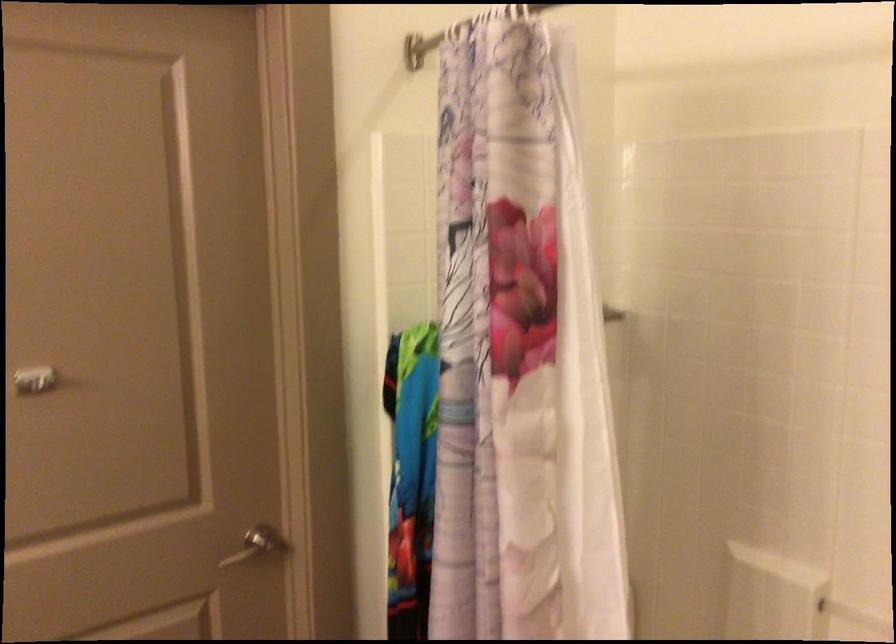
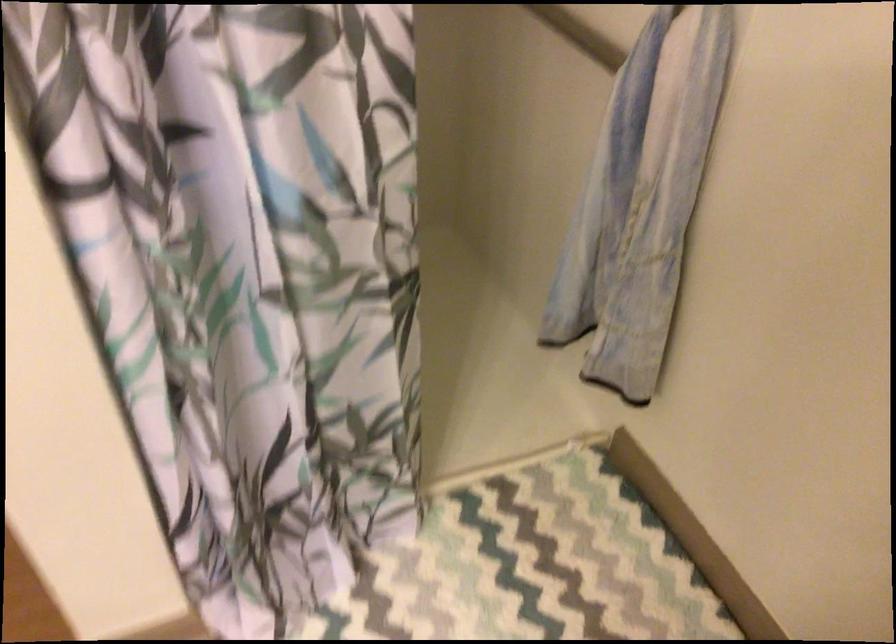
Based on the continuous images, in which direction is the camera rotating?

The camera's rotation is toward right-down.